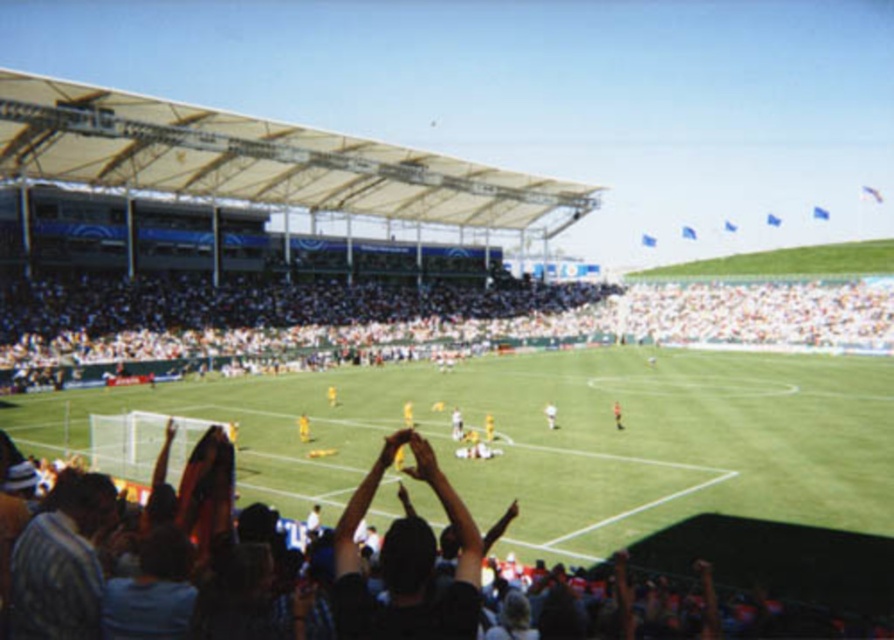
Question: Which of these objects is positioned closest to the yellow jersey at center?

Choices:
 (A) white matte soccer player at center
 (B) black fabric crowd at lower center
 (C) white fabric crowd at lower left
 (D) black fabric at center

Answer: (A)

Question: Which object is closer to the camera taking this photo?

Choices:
 (A) black fabric at center
 (B) black fabric crowd at lower center
 (C) white fabric crowd at lower left
 (D) white matte soccer player at center

Answer: (A)

Question: Observing the image, what is the correct spatial positioning of white fabric crowd at lower left in reference to white matte soccer player at center?

Choices:
 (A) below
 (B) above

Answer: (B)

Question: Which of the following is the farthest from the observer?

Choices:
 (A) coord(547,413)
 (B) coord(580,324)
 (C) coord(842,612)
 (D) coord(614,412)

Answer: (B)

Question: Can you confirm if black fabric crowd at lower center is smaller than yellow jersey at center?

Choices:
 (A) yes
 (B) no

Answer: (B)

Question: Is black fabric crowd at lower center positioned behind black fabric at center?

Choices:
 (A) no
 (B) yes

Answer: (B)